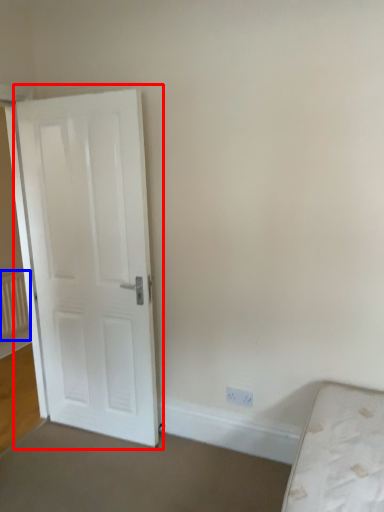
Question: Which of the following is the closest to the observer, door (highlighted by a red box) or radiator (highlighted by a blue box)?

Choices:
 (A) door
 (B) radiator

Answer: (A)